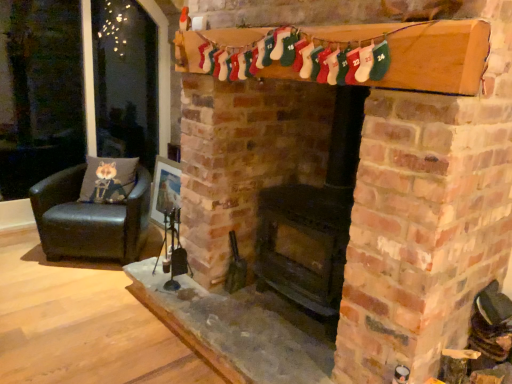
Question: Is black matte fireplace at center in front of gray fabric cushion at left?

Choices:
 (A) no
 (B) yes

Answer: (B)

Question: Considering the relative positions of black matte fireplace at center and gray fabric cushion at left in the image provided, is black matte fireplace at center to the left of gray fabric cushion at left from the viewer's perspective?

Choices:
 (A) yes
 (B) no

Answer: (B)

Question: From a real-world perspective, does black matte fireplace at center sit lower than gray fabric cushion at left?

Choices:
 (A) yes
 (B) no

Answer: (B)

Question: Does black matte fireplace at center have a smaller size compared to gray fabric cushion at left?

Choices:
 (A) yes
 (B) no

Answer: (B)

Question: Is black matte fireplace at center positioned behind gray fabric cushion at left?

Choices:
 (A) yes
 (B) no

Answer: (B)

Question: From a real-world perspective, is black leather chair at left above or below gray fabric cushion at left?

Choices:
 (A) below
 (B) above

Answer: (A)

Question: Is black leather chair at left wider or thinner than gray fabric cushion at left?

Choices:
 (A) thin
 (B) wide

Answer: (B)

Question: From their relative heights in the image, would you say black leather chair at left is taller or shorter than gray fabric cushion at left?

Choices:
 (A) short
 (B) tall

Answer: (B)

Question: From the image's perspective, is black leather chair at left positioned above or below gray fabric cushion at left?

Choices:
 (A) above
 (B) below

Answer: (B)

Question: Is gray fabric cushion at left spatially inside black matte fireplace at center, or outside of it?

Choices:
 (A) outside
 (B) inside

Answer: (A)

Question: Would you say gray fabric cushion at left is to the left or to the right of black matte fireplace at center in the picture?

Choices:
 (A) left
 (B) right

Answer: (A)

Question: Relative to black matte fireplace at center, is gray fabric cushion at left in front or behind?

Choices:
 (A) front
 (B) behind

Answer: (B)

Question: From the image's perspective, is gray fabric cushion at left positioned above or below black matte fireplace at center?

Choices:
 (A) above
 (B) below

Answer: (A)

Question: Is black matte fireplace at center bigger or smaller than black leather chair at left?

Choices:
 (A) big
 (B) small

Answer: (A)

Question: In terms of height, does black matte fireplace at center look taller or shorter compared to black leather chair at left?

Choices:
 (A) tall
 (B) short

Answer: (A)